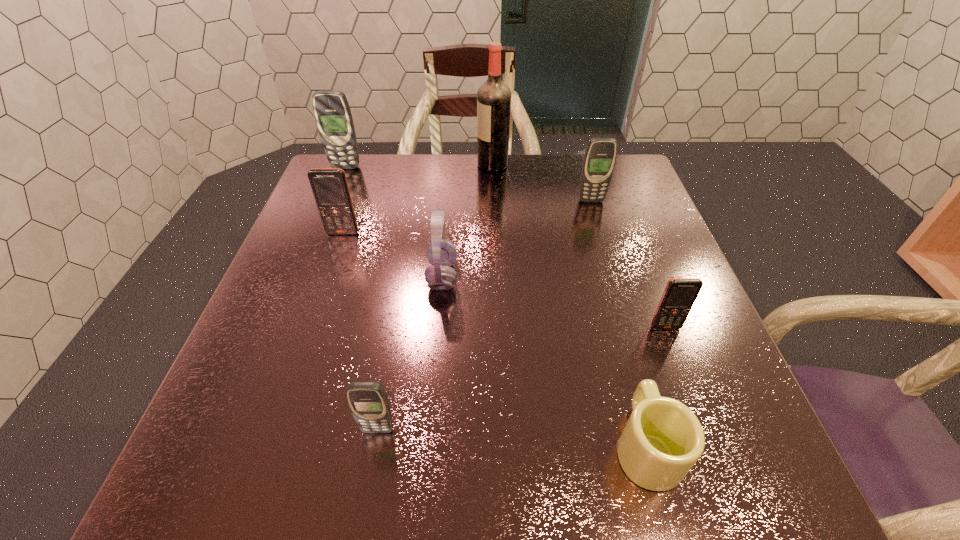
Locate an element on the screen. This screenshot has width=960, height=540. free point located on the screen of the third farthest object is located at coordinates (615, 280).

Where is `free space located on the screen of the fifth nearest object`? This screenshot has height=540, width=960. free space located on the screen of the fifth nearest object is located at coordinates (311, 326).

You are a GUI agent. You are given a task and a screenshot of the screen. Output one action in this format:
    pyautogui.click(x=<x>, y=<y>)
    Task: Click on the free space located 0.110m on the headband and ear cups of the fifth farthest object
    The image size is (960, 540).
    Given the screenshot: What is the action you would take?
    pyautogui.click(x=507, y=276)

Find the location of a particular element. blank area located 0.110m on the screen of the rightmost cellular telephone is located at coordinates (684, 379).

What are the coordinates of `vacant region located 0.050m with the handle on the side of the shortest object` in the screenshot? It's located at (628, 379).

The image size is (960, 540). I want to click on blank space located 0.220m with the handle on the side of the shortest object, so click(x=609, y=307).

Where is `free location located 0.070m with the handle on the side of the shortest object`? This screenshot has height=540, width=960. free location located 0.070m with the handle on the side of the shortest object is located at coordinates (625, 369).

At what (x,y) coordinates should I click in order to perform the action: click on liquor positioned at the far edge. Please return your answer as a coordinate pair (x, y). Image resolution: width=960 pixels, height=540 pixels. Looking at the image, I should click on (493, 97).

What are the coordinates of `object present at the near edge` in the screenshot? It's located at (662, 440).

The width and height of the screenshot is (960, 540). What are the coordinates of `mug that is at the right edge` in the screenshot? It's located at (662, 440).